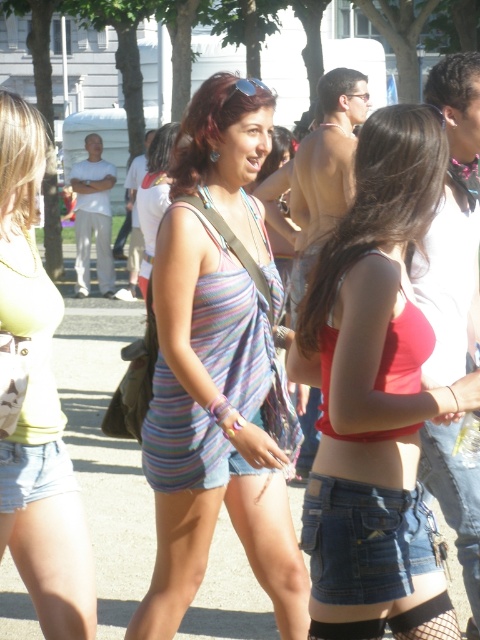
You are standing in the middle of the scene and want to hand a brochure to the person wearing the matte yellow tank top at center and the denim at lower center. Which one should you approach first if you want to greet the person closest to your current position?

The matte yellow tank top at center is to the left of denim at lower center, so you should approach the matte yellow tank top at center first since it is closer to your position in the middle.

Based on the photo, you are a photographer trying to capture a candid shot of the striped fabric dress at center and denim at lower center. Since you want to ensure both are visible in the frame, which object should you prioritize positioning closer to the camera to avoid being cut off?

The striped fabric dress at center is wider than the denim at lower center, so positioning the striped fabric dress at center closer to the camera would ensure it fits within the frame while still capturing the denim at lower center in the background.